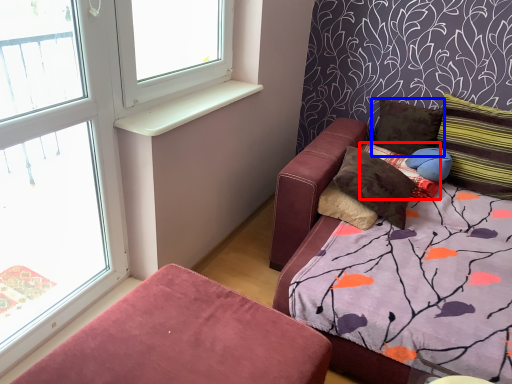
Question: Among these objects, which one is farthest to the camera, pillow (highlighted by a red box) or pillow (highlighted by a blue box)?

Choices:
 (A) pillow
 (B) pillow

Answer: (B)